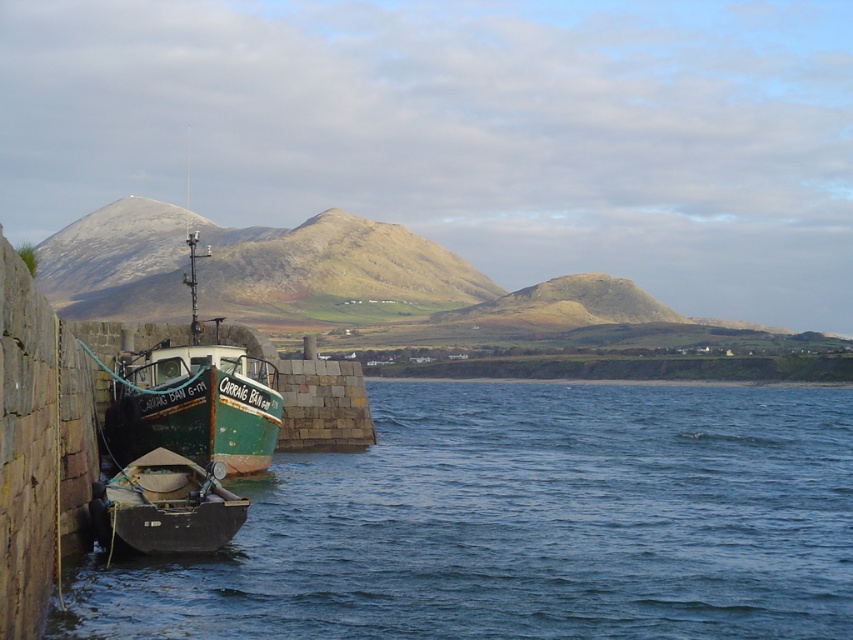
Who is positioned more to the right, blue water at lower left or green matte boat at lower left?

blue water at lower left

Is blue water at lower left taller than green matte boat at lower left?

Yes.

I want to click on blue water at lower left, so click(524, 524).